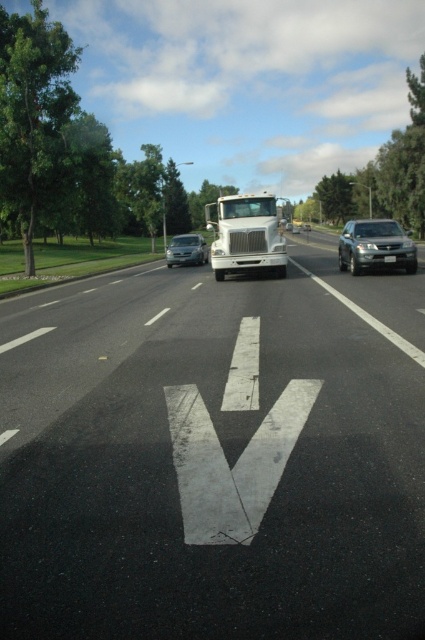
Question: Does white matte truck at center have a lesser width compared to satin silver suv at right?

Choices:
 (A) no
 (B) yes

Answer: (A)

Question: Does white matte truck at center appear on the right side of satin silver suv at right?

Choices:
 (A) yes
 (B) no

Answer: (B)

Question: Which point appears closest to the camera in this image?

Choices:
 (A) (200, 240)
 (B) (278, 250)
 (C) (17, 493)

Answer: (C)

Question: Estimate the real-world distances between objects in this image. Which object is farther from the satin silver sedan at center?

Choices:
 (A) white asphalt road at center
 (B) white matte truck at center

Answer: (B)

Question: Does white asphalt road at center have a smaller size compared to satin silver sedan at center?

Choices:
 (A) yes
 (B) no

Answer: (B)

Question: Which point appears closest to the camera in this image?

Choices:
 (A) (379, 371)
 (B) (342, 266)
 (C) (231, 246)

Answer: (A)